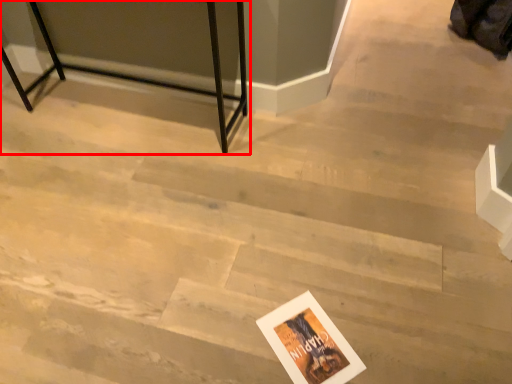
Question: From the image's perspective, considering the relative positions of furniture (annotated by the red box) and postcard in the image provided, where is furniture (annotated by the red box) located with respect to the staircase?

Choices:
 (A) below
 (B) above

Answer: (B)